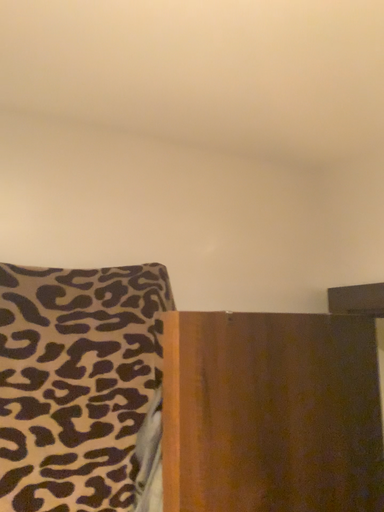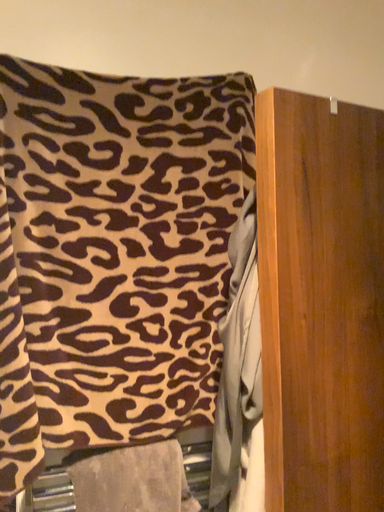
Question: Which way did the camera rotate in the video?

Choices:
 (A) rotated left
 (B) rotated right

Answer: (A)